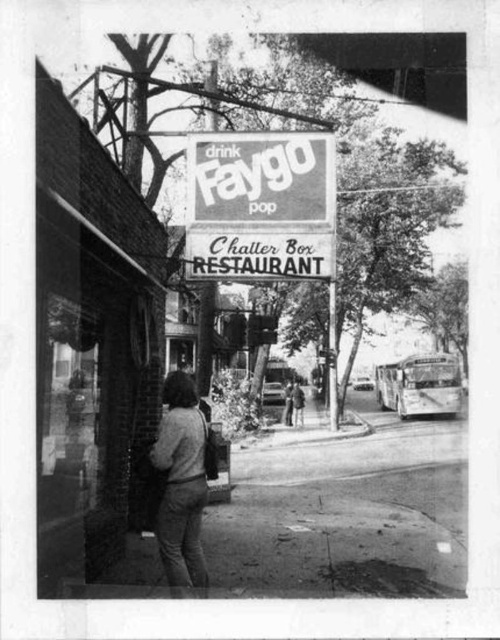
Question: Can you confirm if white paper sign at center is thinner than smooth leather jacket at center?

Choices:
 (A) no
 (B) yes

Answer: (B)

Question: Which point is closer to the camera?

Choices:
 (A) matte gray sweater at center
 (B) smooth leather jacket at center

Answer: (A)

Question: Can you confirm if brick wall at left is thinner than white paper sign at center?

Choices:
 (A) no
 (B) yes

Answer: (B)

Question: Which object is farther from the camera taking this photo?

Choices:
 (A) matte gray sweater at center
 (B) smooth leather jacket at center
 (C) white paper sign at center

Answer: (B)

Question: Which point is closer to the camera?

Choices:
 (A) brick wall at left
 (B) white paper sign at center

Answer: (A)

Question: Is the position of white paper sign at center more distant than that of matte gray sweater at center?

Choices:
 (A) no
 (B) yes

Answer: (B)